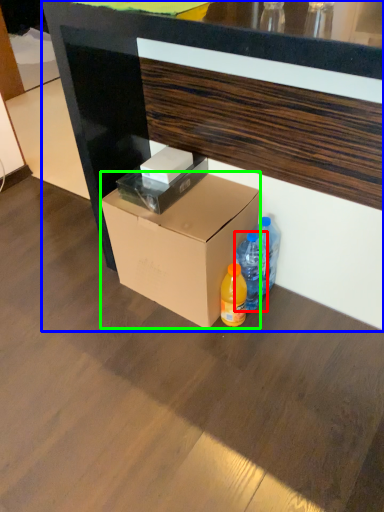
Question: Which object is positioned closest to bottle (highlighted by a red box)? Select from desk (highlighted by a blue box) and box (highlighted by a green box).

Choices:
 (A) desk
 (B) box

Answer: (B)